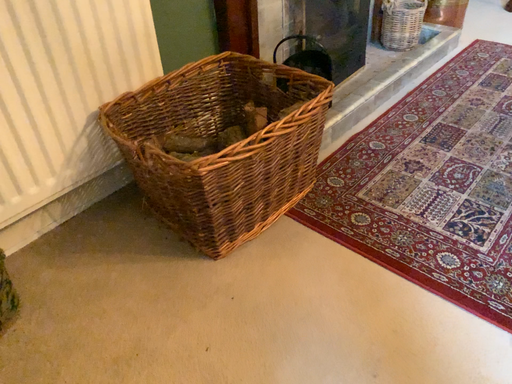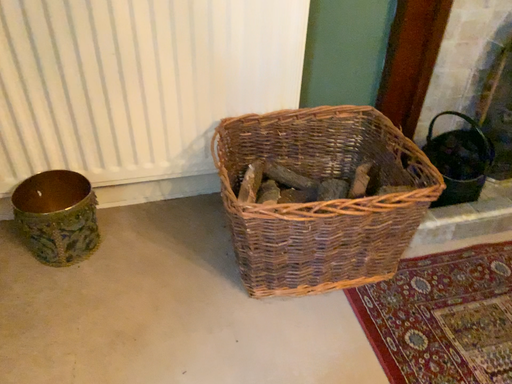
Question: Which way did the camera rotate in the video?

Choices:
 (A) rotated right
 (B) rotated left

Answer: (B)